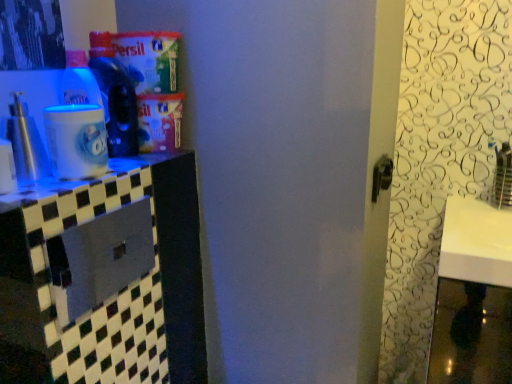
This screenshot has width=512, height=384. In order to click on metallic gray drawer at left in this screenshot , I will do `click(100, 259)`.

How much space does translucent plastic bottle at upper left, which is the 2th bottle in front-to-back order, occupy horizontally?

The width of translucent plastic bottle at upper left, which is the 2th bottle in front-to-back order, is 5.00 inches.

Identify the location of metallic silver spray at left, the second bottle when ordered from back to front. (26, 142).

I want to click on white glossy counter top at left, so click(115, 188).

Is translucent plastic bottle at upper left, the second bottle in the left-to-right sequence, not inside metallic gray drawer at left?

Yes, translucent plastic bottle at upper left, the second bottle in the left-to-right sequence, is outside of metallic gray drawer at left.

Between translucent plastic bottle at upper left, which is counted as the 1th bottle, starting from the right, and metallic gray drawer at left, which one has larger size?

Bigger between the two is translucent plastic bottle at upper left, which is counted as the 1th bottle, starting from the right.

In terms of height, does translucent plastic bottle at upper left, which is the 2th bottle in front-to-back order, look taller or shorter compared to metallic gray drawer at left?

In the image, translucent plastic bottle at upper left, which is the 2th bottle in front-to-back order, appears to be taller than metallic gray drawer at left.

Locate an element on the screen. This screenshot has width=512, height=384. drawer behind the white glossy counter top at left is located at coordinates (100, 259).

From the image's perspective, is white glossy counter top at left located beneath metallic gray drawer at left?

No, from the image's perspective, white glossy counter top at left is not below metallic gray drawer at left.

Can you confirm if white glossy counter top at left is bigger than metallic gray drawer at left?

No.

Which is farther from the camera, (18, 164) or (54, 277)?

Point (18, 164)

Which of these two, metallic silver spray at left, marked as the second bottle in a right-to-left arrangement, or metallic gray drawer at left, stands shorter?

metallic silver spray at left, marked as the second bottle in a right-to-left arrangement, is shorter.

Can you confirm if metallic silver spray at left, marked as the second bottle in a right-to-left arrangement, is positioned to the left of metallic gray drawer at left?

Correct, you'll find metallic silver spray at left, marked as the second bottle in a right-to-left arrangement, to the left of metallic gray drawer at left.

Between metallic gray drawer at left and white glossy counter top at left, which one has more height?

With more height is metallic gray drawer at left.

From the picture: Considering the positions of objects metallic gray drawer at left and white glossy counter top at left in the image provided, who is behind, metallic gray drawer at left or white glossy counter top at left?

metallic gray drawer at left is further from the camera.

The height and width of the screenshot is (384, 512). Identify the location of drawer on the right of the white glossy counter top at left. pos(100,259).

What's the angular difference between metallic gray drawer at left and white glossy counter top at left's facing directions?

They differ by 0.000588 degrees in their facing directions.

Which point is more distant from viewer, (x=109, y=239) or (x=36, y=128)?

The point (x=109, y=239) is behind.

The width and height of the screenshot is (512, 384). In order to click on drawer that is in front of the metallic silver spray at left, the 1th bottle when ordered from left to right in this screenshot , I will do tap(100, 259).

From the image's perspective, which is above, metallic gray drawer at left or metallic silver spray at left, the second bottle when ordered from back to front?

From the image's view, metallic silver spray at left, the second bottle when ordered from back to front, is above.

Can you confirm if metallic gray drawer at left is thinner than metallic silver spray at left, the 1th bottle when ordered from left to right?

Correct, the width of metallic gray drawer at left is less than that of metallic silver spray at left, the 1th bottle when ordered from left to right.

Looking at this image, relative to translucent plastic bottle at upper left, which is the 2th bottle in front-to-back order, is white glossy counter top at left in front or behind?

white glossy counter top at left is in front of translucent plastic bottle at upper left, which is the 2th bottle in front-to-back order.

Considering the sizes of objects white glossy counter top at left and translucent plastic bottle at upper left, which is counted as the 1th bottle, starting from the right, in the image provided, who is bigger, white glossy counter top at left or translucent plastic bottle at upper left, which is counted as the 1th bottle, starting from the right,?

Bigger between the two is translucent plastic bottle at upper left, which is counted as the 1th bottle, starting from the right.

Is there a large distance between white glossy counter top at left and translucent plastic bottle at upper left, the 1th bottle viewed from the back?

Actually, white glossy counter top at left and translucent plastic bottle at upper left, the 1th bottle viewed from the back, are a little close together.

Is white glossy counter top at left shorter than translucent plastic bottle at upper left, which is the 2th bottle in front-to-back order?

Correct, white glossy counter top at left is not as tall as translucent plastic bottle at upper left, which is the 2th bottle in front-to-back order.

Which is closer to the camera, (145, 188) or (28, 126)?

Clearly, point (145, 188) is more distant from the camera than point (28, 126).

Considering the relative positions of white glossy counter top at left and metallic silver spray at left, the first bottle when ordered from front to back, in the image provided, is white glossy counter top at left to the left of metallic silver spray at left, the first bottle when ordered from front to back, from the viewer's perspective?

In fact, white glossy counter top at left is to the right of metallic silver spray at left, the first bottle when ordered from front to back.

Is white glossy counter top at left spatially inside metallic silver spray at left, the first bottle when ordered from front to back, or outside of it?

white glossy counter top at left is located beyond the bounds of metallic silver spray at left, the first bottle when ordered from front to back.

Identify the location of the 2nd bottle behind the metallic gray drawer at left. (115, 96).

Image resolution: width=512 pixels, height=384 pixels. In order to click on drawer below the white glossy counter top at left (from the image's perspective) in this screenshot , I will do `click(100, 259)`.

When comparing their distances from white glossy counter top at left, does metallic gray drawer at left or metallic silver spray at left, the second bottle when ordered from back to front, seem closer?

The object closer to white glossy counter top at left is metallic silver spray at left, the second bottle when ordered from back to front.

Based on the photo, estimate the real-world distances between objects in this image. Which object is further from metallic silver spray at left, the 1th bottle when ordered from left to right, metallic gray drawer at left or white glossy counter top at left?

metallic gray drawer at left is further to metallic silver spray at left, the 1th bottle when ordered from left to right.

Which object lies nearer to the anchor point white glossy counter top at left, translucent plastic bottle at upper left, the 1th bottle viewed from the back, or metallic gray drawer at left?

translucent plastic bottle at upper left, the 1th bottle viewed from the back, is positioned closer to the anchor white glossy counter top at left.

Looking at this image, considering their positions, is translucent plastic bottle at upper left, the second bottle in the left-to-right sequence, positioned closer to metallic silver spray at left, the 1th bottle when ordered from left to right, than white glossy counter top at left?

white glossy counter top at left.

Looking at the image, which one is located further to metallic silver spray at left, the 1th bottle when ordered from left to right, translucent plastic bottle at upper left, which is counted as the 1th bottle, starting from the right, or metallic gray drawer at left?

metallic gray drawer at left.

Based on the photo, considering their positions, is metallic gray drawer at left positioned closer to translucent plastic bottle at upper left, which is the 2th bottle in front-to-back order, than white glossy counter top at left?

Among the two, white glossy counter top at left is located nearer to translucent plastic bottle at upper left, which is the 2th bottle in front-to-back order.

Considering their positions, is translucent plastic bottle at upper left, which is counted as the 1th bottle, starting from the right, positioned closer to metallic gray drawer at left than white glossy counter top at left?

Based on the image, white glossy counter top at left appears to be nearer to metallic gray drawer at left.

Estimate the real-world distances between objects in this image. Which object is closer to translucent plastic bottle at upper left, which is counted as the 1th bottle, starting from the right, white glossy counter top at left or metallic silver spray at left, marked as the second bottle in a right-to-left arrangement?

white glossy counter top at left is positioned closer to the anchor translucent plastic bottle at upper left, which is counted as the 1th bottle, starting from the right.

The height and width of the screenshot is (384, 512). In order to click on counter top between metallic silver spray at left, the second bottle when ordered from back to front, and metallic gray drawer at left, in the vertical direction in this screenshot , I will do `click(115, 188)`.

The width and height of the screenshot is (512, 384). Identify the location of bottle between white glossy counter top at left and translucent plastic bottle at upper left, the second bottle in the left-to-right sequence, along the z-axis. (26, 142).

Where is `counter top between translucent plastic bottle at upper left, the second bottle in the left-to-right sequence, and metallic gray drawer at left in the up-down direction`? counter top between translucent plastic bottle at upper left, the second bottle in the left-to-right sequence, and metallic gray drawer at left in the up-down direction is located at coordinates (115, 188).

At what (x,y) coordinates should I click in order to perform the action: click on bottle between translucent plastic bottle at upper left, which is the 2th bottle in front-to-back order, and metallic gray drawer at left from top to bottom. Please return your answer as a coordinate pair (x, y). This screenshot has width=512, height=384. Looking at the image, I should click on pyautogui.click(x=26, y=142).